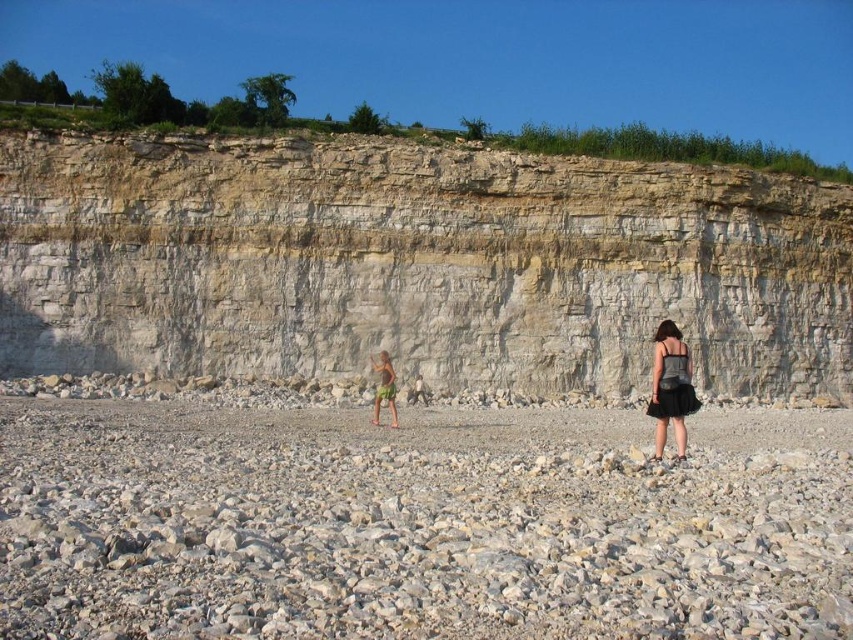
You are a hiker who wants to take a photo of the white rock cliff at center and the gray gravel beach at center. Which object should you focus on first if you want to capture both in one frame without moving your camera? Explain your reasoning based on their positions.

You should focus on the gray gravel beach at center first because the white rock cliff at center is positioned to the right of it, so by centering the gray gravel beach at center in your frame, you can adjust your camera to include both objects without moving it.